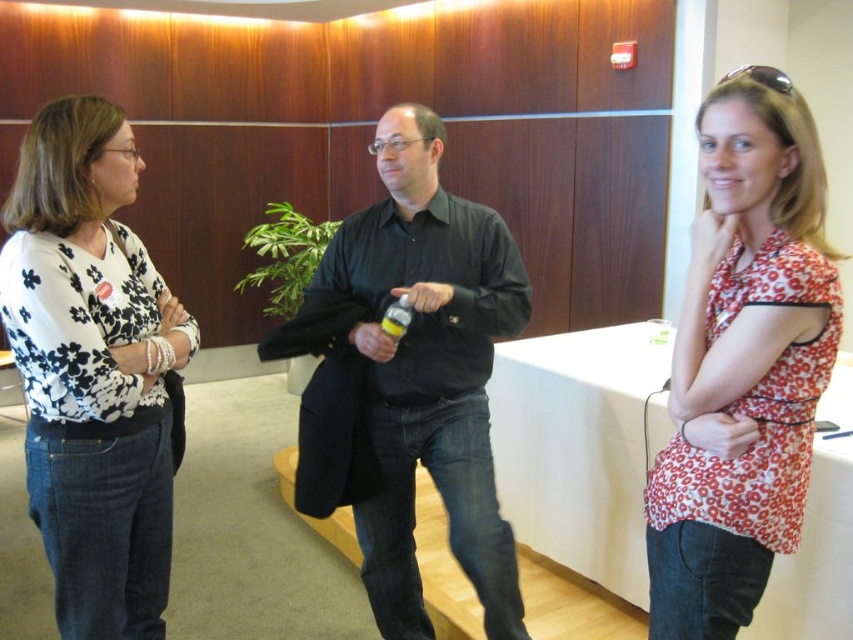
Question: Does floral fabric blouse at right appear over yellow matte bottle at center?

Choices:
 (A) no
 (B) yes

Answer: (A)

Question: Which point is farther from the camera taking this photo?

Choices:
 (A) 389,332
 (B) 151,396
 (C) 457,369
 (D) 674,563

Answer: (C)

Question: Is floral fabric blouse at right to the right of yellow matte bottle at center from the viewer's perspective?

Choices:
 (A) no
 (B) yes

Answer: (B)

Question: Which object is closer to the camera taking this photo?

Choices:
 (A) black matte shirt at center
 (B) floral fabric blouse at right
 (C) white floral blouse at left

Answer: (B)

Question: Can you confirm if floral fabric blouse at right is wider than yellow matte bottle at center?

Choices:
 (A) no
 (B) yes

Answer: (B)

Question: Which point is farther to the camera?

Choices:
 (A) (486, 564)
 (B) (393, 304)
 (C) (148, 556)
 (D) (728, 195)

Answer: (A)